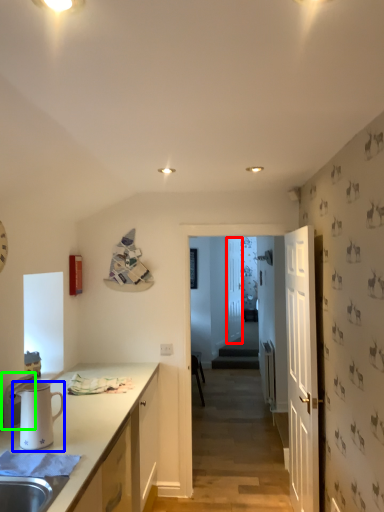
Question: Which object is positioned farthest from glass door (highlighted by a red box)? Select from pitcher (highlighted by a blue box) and appliance (highlighted by a green box).

Choices:
 (A) pitcher
 (B) appliance

Answer: (A)